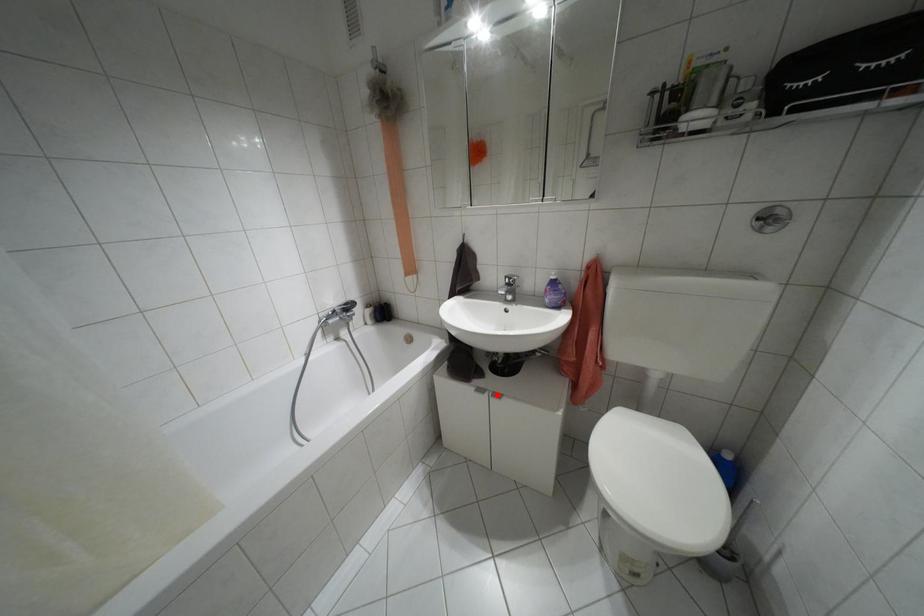
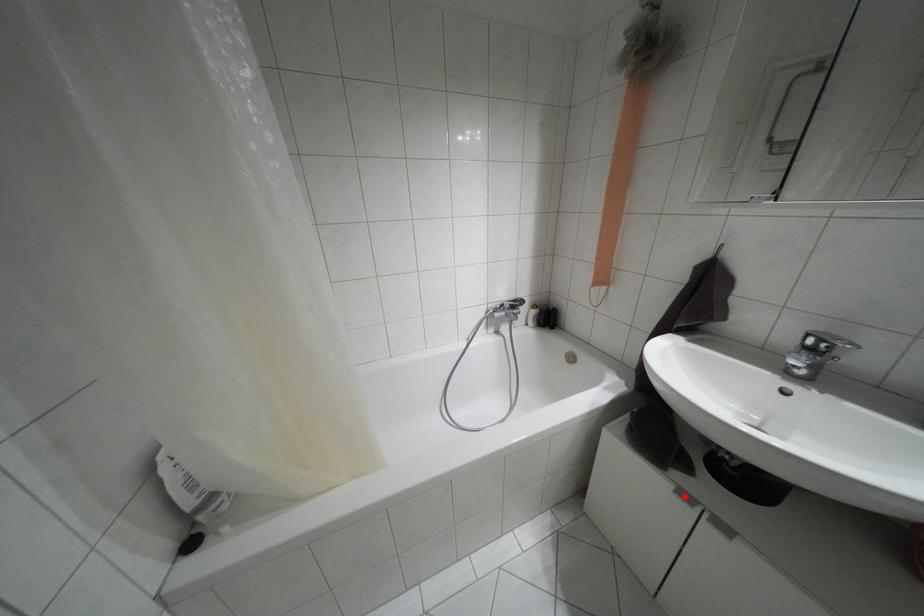
I am providing you with two images of the same scene from different viewpoints. A red point is marked on the first image and another point is marked on the second image. Do the highlighted points in image1 and image2 indicate the same real-world spot?

No